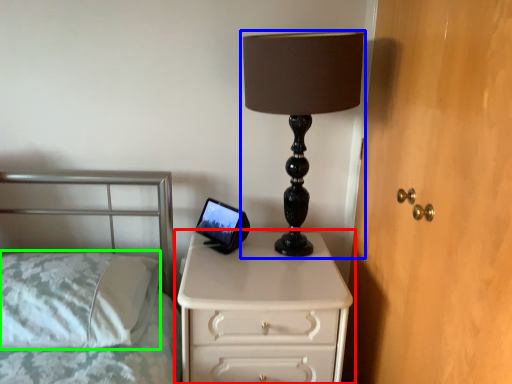
Question: Which object is positioned closest to chest of drawers (highlighted by a red box)? Select from lamp (highlighted by a blue box) and pillow (highlighted by a green box).

Choices:
 (A) lamp
 (B) pillow

Answer: (B)